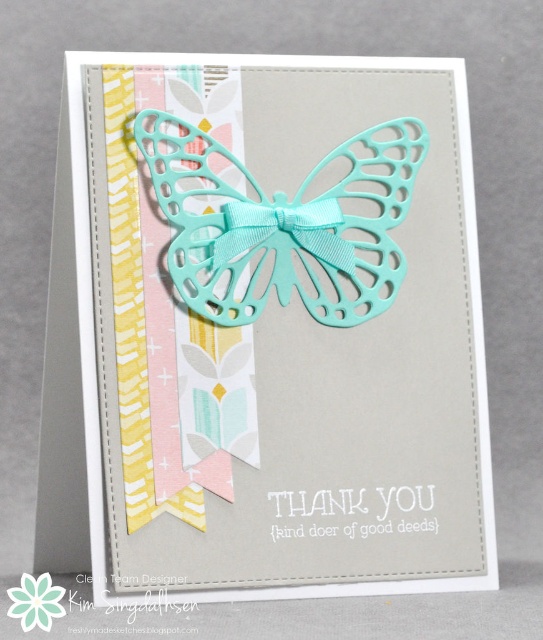
Question: Can you confirm if mint glossy butterfly at center is positioned below tiffany blue grosgrain ribbon at center?

Choices:
 (A) yes
 (B) no

Answer: (B)

Question: Which point appears closest to the camera in this image?

Choices:
 (A) (80, 148)
 (B) (392, 176)
 (C) (321, 212)

Answer: (A)

Question: Estimate the real-world distances between objects in this image. Which object is closer to the mint glossy butterfly at center?

Choices:
 (A) tiffany blue grosgrain ribbon at center
 (B) matte teal butterfly at upper center

Answer: (A)

Question: Does mint glossy butterfly at center have a lesser width compared to tiffany blue grosgrain ribbon at center?

Choices:
 (A) no
 (B) yes

Answer: (A)

Question: Estimate the real-world distances between objects in this image. Which object is closer to the tiffany blue grosgrain ribbon at center?

Choices:
 (A) matte teal butterfly at upper center
 (B) mint glossy butterfly at center

Answer: (B)

Question: Is matte teal butterfly at upper center closer to the viewer compared to tiffany blue grosgrain ribbon at center?

Choices:
 (A) no
 (B) yes

Answer: (B)